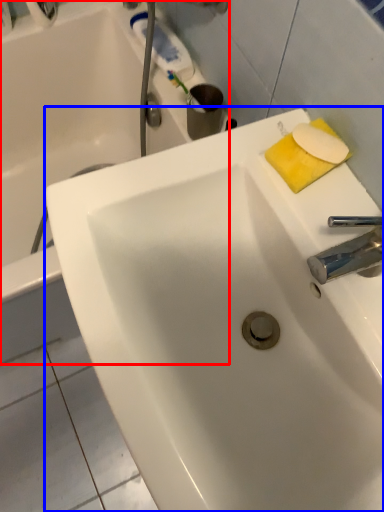
Question: Which object appears closest to the camera in this image, bathtub (highlighted by a red box) or sink (highlighted by a blue box)?

Choices:
 (A) bathtub
 (B) sink

Answer: (B)